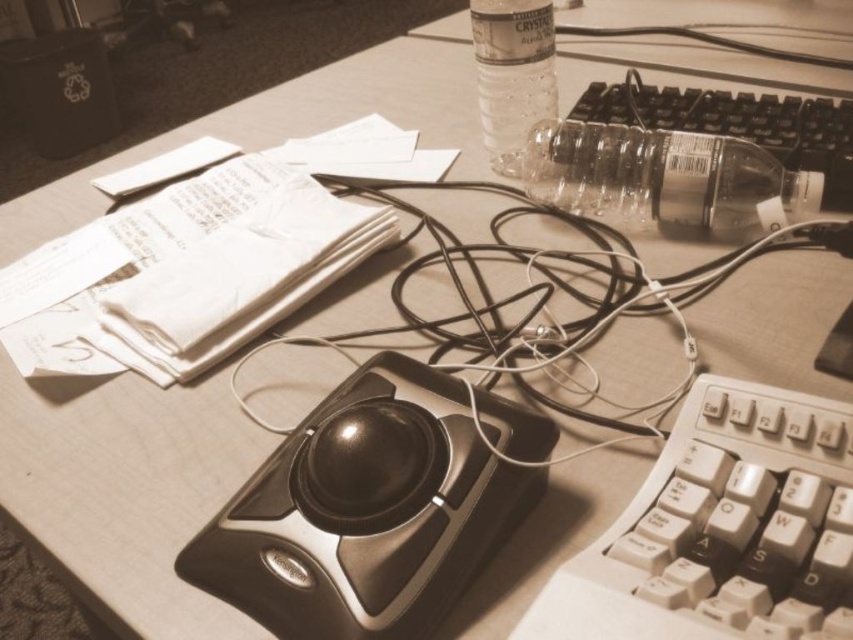
Question: Is black cable at center to the left of transparent plastic bottle at center-right from the viewer's perspective?

Choices:
 (A) no
 (B) yes

Answer: (B)

Question: Which point is closer to the camera?

Choices:
 (A) (303, 492)
 (B) (479, 26)
 (C) (694, 342)
 (D) (718, 141)

Answer: (A)

Question: Can you confirm if black cable at center is wider than clear plastic bottle at upper center?

Choices:
 (A) no
 (B) yes

Answer: (B)

Question: Does transparent plastic bottle at center-right appear under clear plastic bottle at upper center?

Choices:
 (A) yes
 (B) no

Answer: (A)

Question: Which of these objects is positioned closest to the white plastic keyboard at lower right?

Choices:
 (A) clear plastic bottle at upper center
 (B) clear plastic keyboard at center right

Answer: (B)

Question: Which of the following is the farthest from the observer?

Choices:
 (A) black plastic trackball at center
 (B) clear plastic keyboard at center right
 (C) white plastic keyboard at lower right
 (D) clear plastic bottle at upper center

Answer: (D)